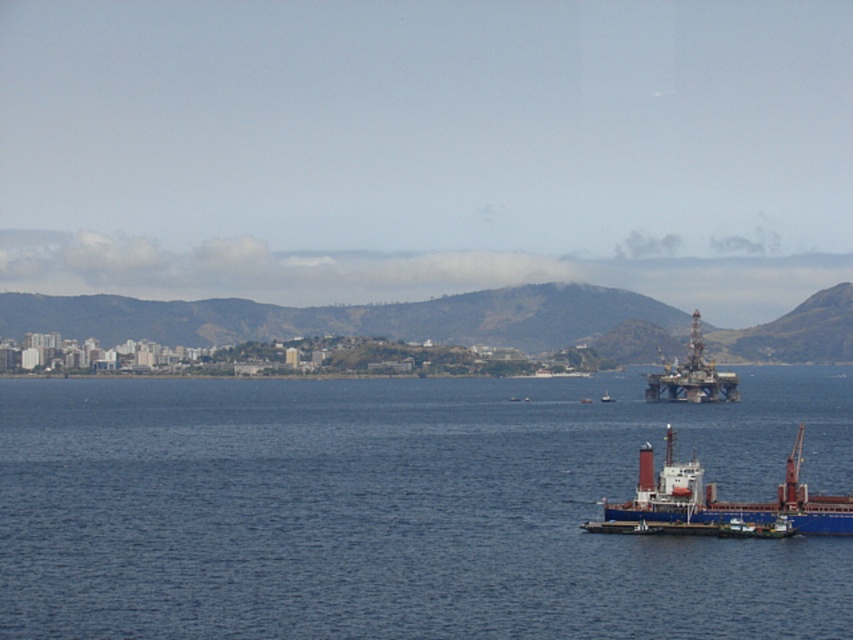
Does blue water at lower left have a greater width compared to white plastic boat at center?

Yes, blue water at lower left is wider than white plastic boat at center.

Based on the photo, does blue water at lower left appear on the right side of white plastic boat at center?

A: Incorrect, blue water at lower left is not on the right side of white plastic boat at center.

Locate an element on the screen. blue water at lower left is located at coordinates (402, 508).

Where is `blue water at lower left`? blue water at lower left is located at coordinates (402, 508).

Does point (677, 525) come closer to viewer compared to point (712, 378)?

Yes, point (677, 525) is closer to viewer.

Is blue matte cargo ship at lower right below metallic oil rig at upper right?

Indeed, blue matte cargo ship at lower right is positioned under metallic oil rig at upper right.

Between point (792, 448) and point (712, 394), which one is positioned behind?

Point (712, 394)

This screenshot has height=640, width=853. Find the location of `blue matte cargo ship at lower right`. blue matte cargo ship at lower right is located at coordinates (718, 502).

Is blue matte cargo ship at lower right smaller than white plastic boat at center?

No, blue matte cargo ship at lower right is not smaller than white plastic boat at center.

Who is higher up, blue matte cargo ship at lower right or white plastic boat at center?

white plastic boat at center is above.

The width and height of the screenshot is (853, 640). I want to click on blue matte cargo ship at lower right, so 718,502.